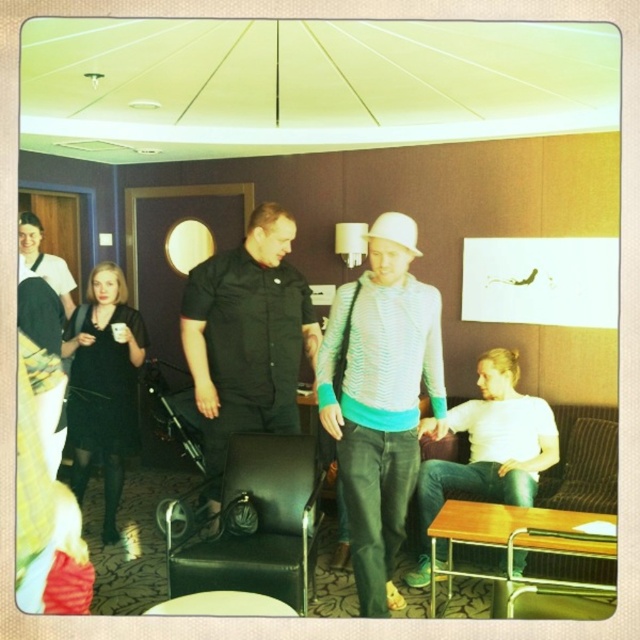
Question: Can you confirm if black matte chef's coat at center is positioned below white matte hat at center?

Choices:
 (A) yes
 (B) no

Answer: (A)

Question: Which point is closer to the camera taking this photo?

Choices:
 (A) (486, 490)
 (B) (413, 228)

Answer: (B)

Question: Which point is farther from the camera taking this photo?

Choices:
 (A) (385, 294)
 (B) (225, 596)

Answer: (A)

Question: Which point is farther from the camera taking this photo?

Choices:
 (A) (212, 339)
 (B) (104, 275)
 (C) (372, 234)

Answer: (B)

Question: Does knitted sweater at center appear over black dress at left?

Choices:
 (A) yes
 (B) no

Answer: (B)

Question: Is knitted sweater at center bigger than black matte chef's coat at center?

Choices:
 (A) yes
 (B) no

Answer: (A)